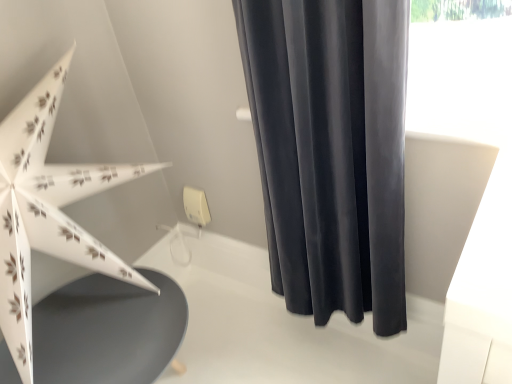
Question: From a real-world perspective, is dark gray velvet curtain at upper right over matte gray table at lower left?

Choices:
 (A) no
 (B) yes

Answer: (B)

Question: Considering the relative sizes of dark gray velvet curtain at upper right and matte gray table at lower left in the image provided, is dark gray velvet curtain at upper right taller than matte gray table at lower left?

Choices:
 (A) yes
 (B) no

Answer: (A)

Question: Considering the relative sizes of dark gray velvet curtain at upper right and matte gray table at lower left in the image provided, is dark gray velvet curtain at upper right wider than matte gray table at lower left?

Choices:
 (A) no
 (B) yes

Answer: (A)

Question: Does dark gray velvet curtain at upper right have a larger size compared to matte gray table at lower left?

Choices:
 (A) no
 (B) yes

Answer: (A)

Question: Does dark gray velvet curtain at upper right touch matte gray table at lower left?

Choices:
 (A) no
 (B) yes

Answer: (A)

Question: From a real-world perspective, is dark gray velvet curtain at upper right positioned under matte gray table at lower left based on gravity?

Choices:
 (A) no
 (B) yes

Answer: (A)

Question: Is dark gray velvet curtain at upper right shorter than white paper umbrella at left?

Choices:
 (A) yes
 (B) no

Answer: (A)

Question: Is dark gray velvet curtain at upper right not close to white paper umbrella at left?

Choices:
 (A) no
 (B) yes

Answer: (A)

Question: Is white paper umbrella at left located within dark gray velvet curtain at upper right?

Choices:
 (A) yes
 (B) no

Answer: (B)

Question: From the image's perspective, is dark gray velvet curtain at upper right located beneath white paper umbrella at left?

Choices:
 (A) no
 (B) yes

Answer: (A)

Question: Is dark gray velvet curtain at upper right thinner than white paper umbrella at left?

Choices:
 (A) no
 (B) yes

Answer: (B)

Question: Is dark gray velvet curtain at upper right positioned beyond the bounds of white paper umbrella at left?

Choices:
 (A) yes
 (B) no

Answer: (A)

Question: Can we say matte gray table at lower left lies outside white paper umbrella at left?

Choices:
 (A) yes
 (B) no

Answer: (A)